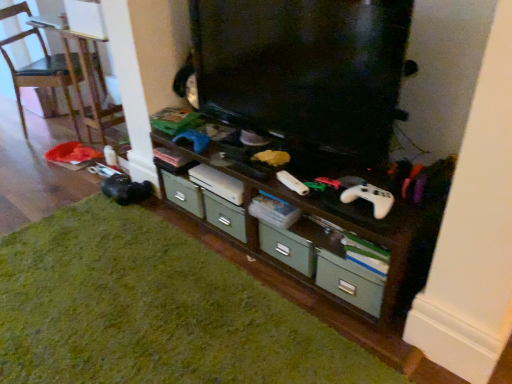
Find the location of `vacant region to the left of green matte drawer at lower center`. vacant region to the left of green matte drawer at lower center is located at coordinates (296, 311).